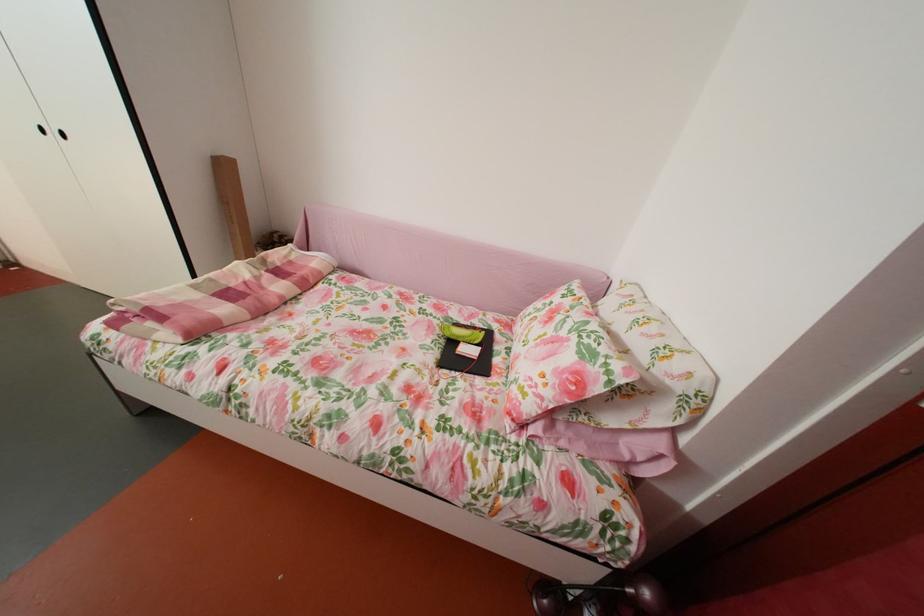
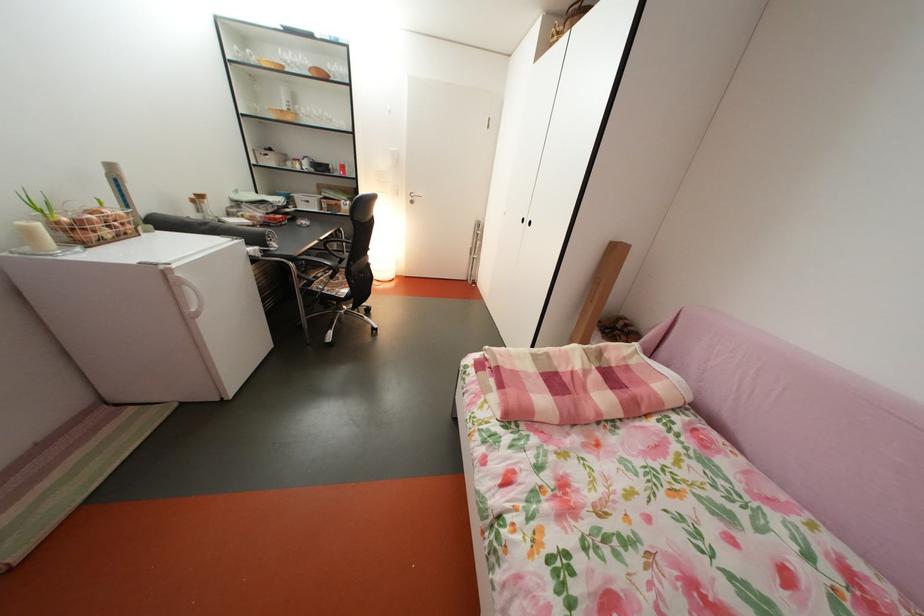
Where in the second image is the point corresponding to pixel 65 139 from the first image?

(538, 228)